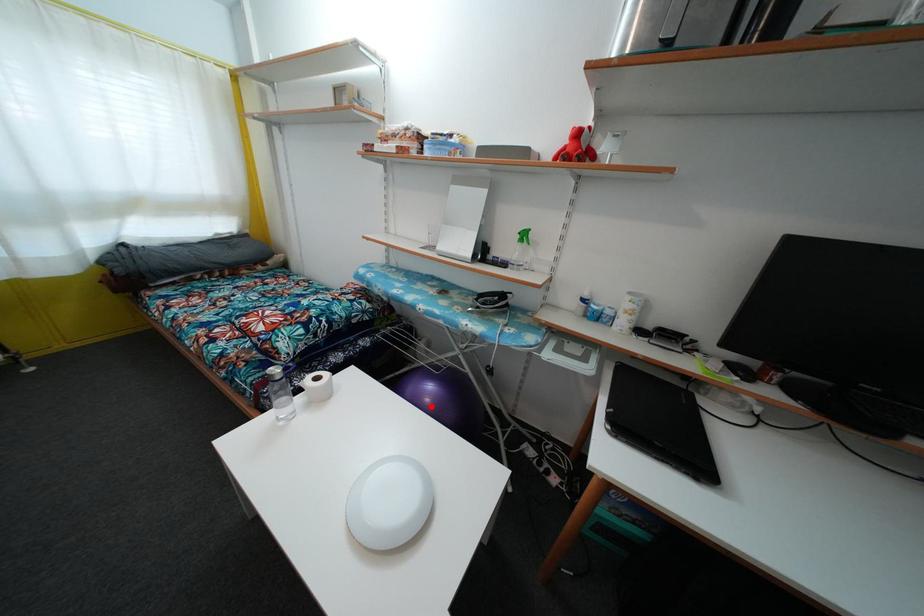
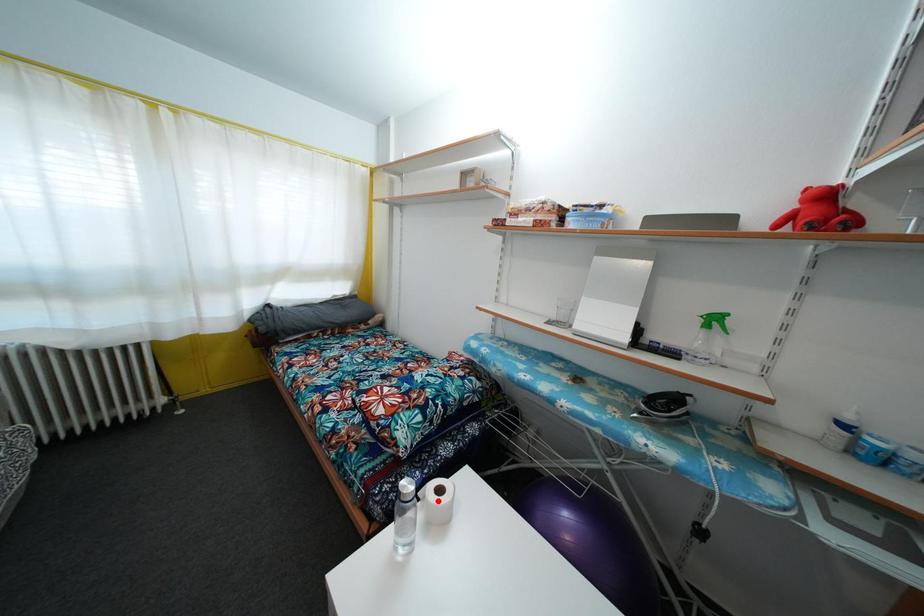
I am providing you with two images of the same scene from different viewpoints. A red point is marked on the first image and another point is marked on the second image. Are the points marked in image1 and image2 representing the same 3D position?

No